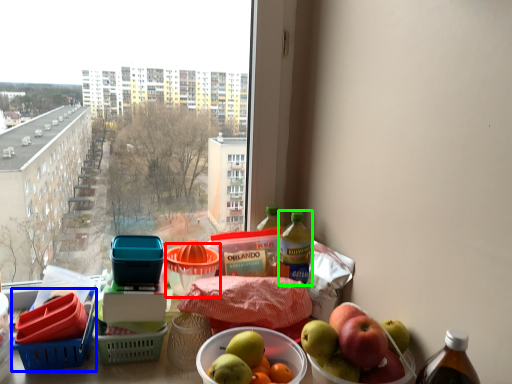
Question: Which is nearer to the basket (highlighted by a red box)? basket (highlighted by a blue box) or bottle (highlighted by a green box).

Choices:
 (A) basket
 (B) bottle

Answer: (B)